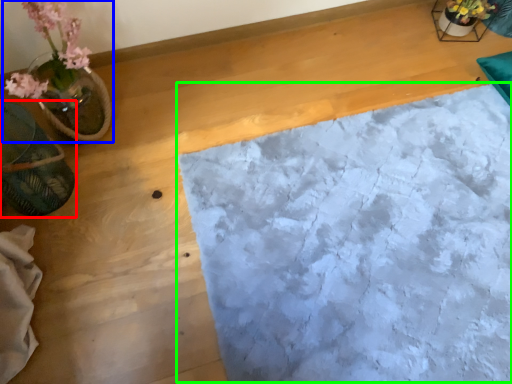
Question: Which object is positioned closest to flowerpot (highlighted by a red box)? Select from houseplant (highlighted by a blue box) and sheet (highlighted by a green box).

Choices:
 (A) houseplant
 (B) sheet

Answer: (A)